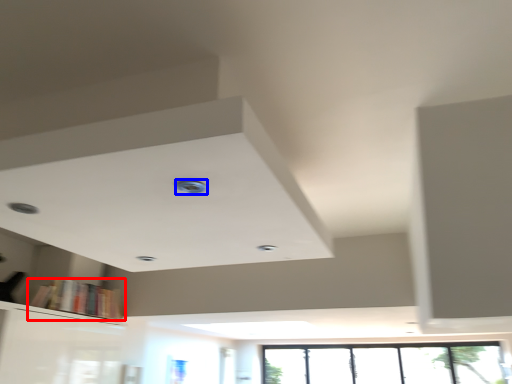
Question: Which point is closer to the camera, book (highlighted by a red box) or hole (highlighted by a blue box)?

Choices:
 (A) book
 (B) hole

Answer: (B)